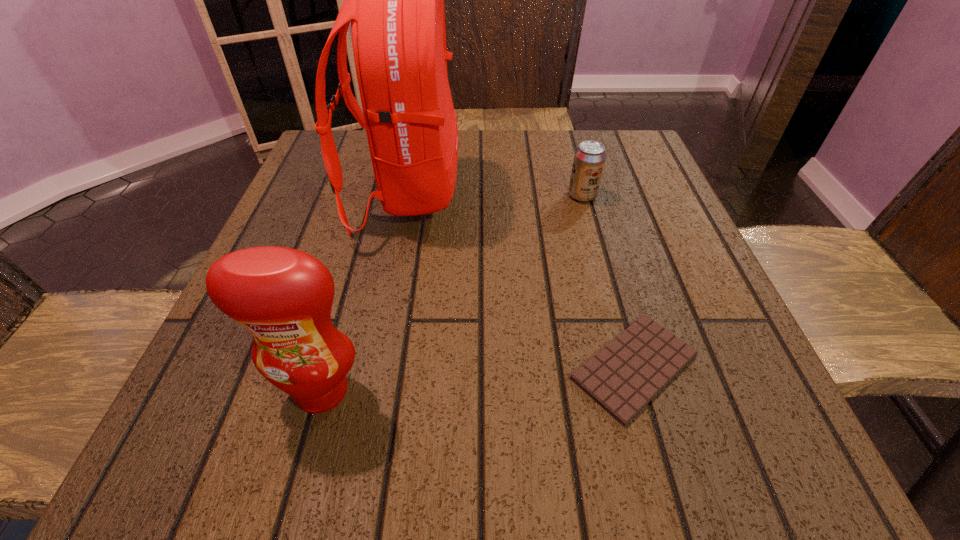
Where is `chocolate bar that is at the near edge`? chocolate bar that is at the near edge is located at coordinates (623, 377).

The height and width of the screenshot is (540, 960). In order to click on backpack that is at the left edge in this screenshot , I will do coord(395,0).

Identify the location of condiment that is at the left edge. (283, 296).

Locate an element on the screen. The image size is (960, 540). beer can that is at the right edge is located at coordinates (589, 160).

The width and height of the screenshot is (960, 540). In order to click on chocolate bar that is at the right edge in this screenshot , I will do `click(623, 377)`.

You are a GUI agent. You are given a task and a screenshot of the screen. Output one action in this format:
    pyautogui.click(x=<x>, y=<y>)
    Task: Click on the object located at the far left corner
    The width and height of the screenshot is (960, 540).
    Given the screenshot: What is the action you would take?
    pyautogui.click(x=395, y=0)

Find the location of a particular element. object that is at the near left corner is located at coordinates (283, 296).

You are a GUI agent. You are given a task and a screenshot of the screen. Output one action in this format:
    pyautogui.click(x=<x>, y=<y>)
    Task: Click on the object situated at the near right corner
    This screenshot has height=540, width=960.
    Given the screenshot: What is the action you would take?
    pyautogui.click(x=623, y=377)

I want to click on free space at the far edge of the desktop, so tap(517, 152).

The image size is (960, 540). In order to click on free space at the near edge of the desktop in this screenshot , I will do `click(635, 457)`.